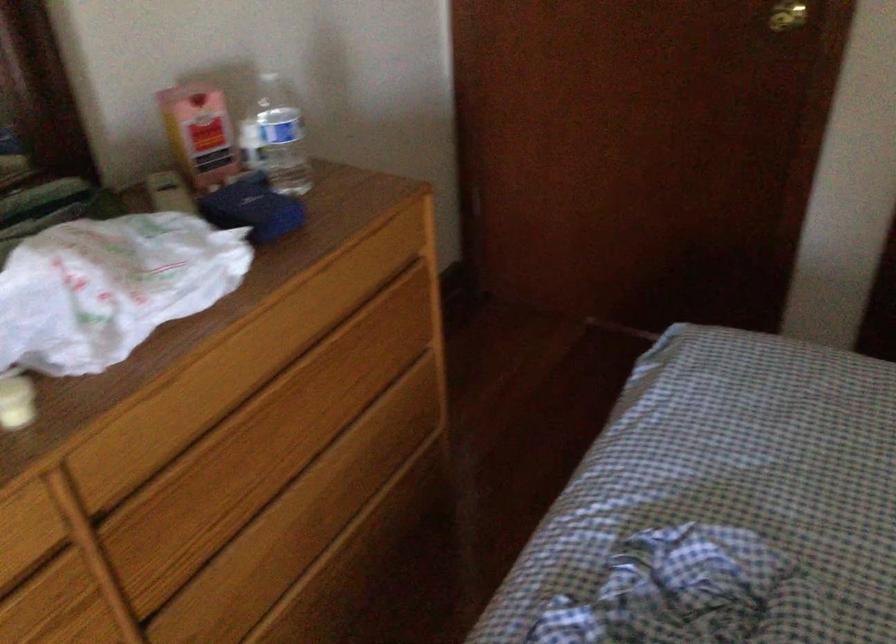
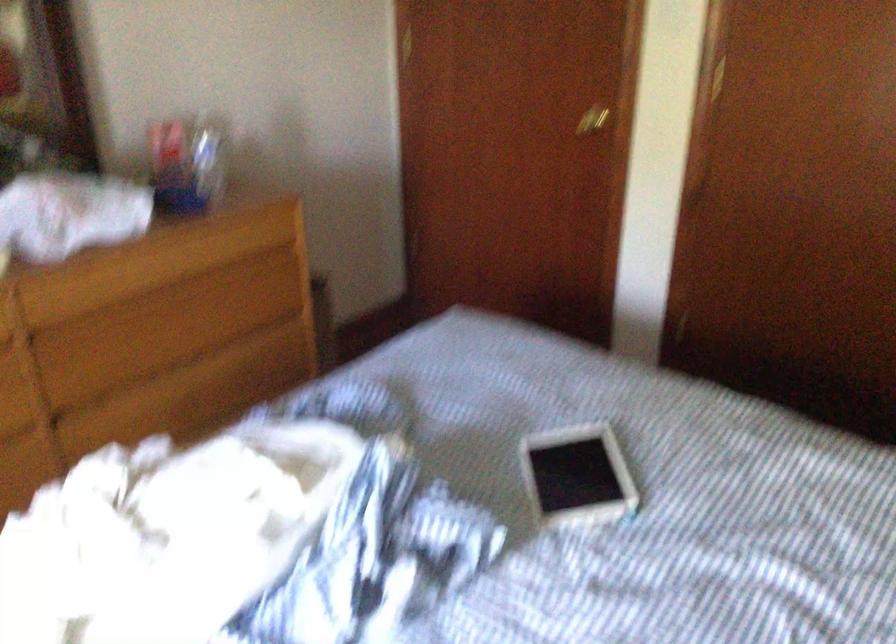
Question: The images are taken continuously from a first-person perspective. In which direction is your viewpoint rotating?

Choices:
 (A) Left
 (B) Right
 (C) Up
 (D) Down

Answer: (A)